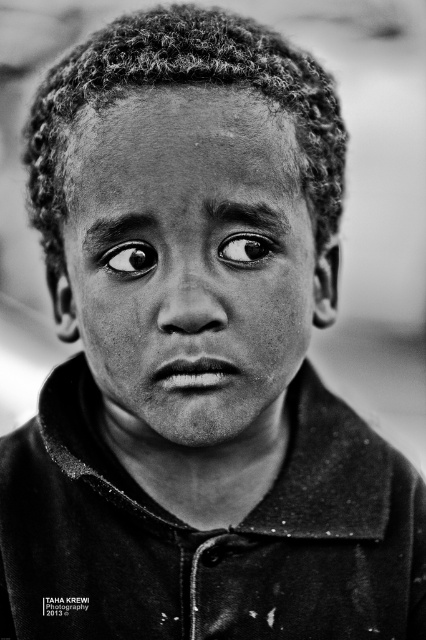
Can you confirm if smooth skin face at center is taller than black matte eye at center?

Indeed, smooth skin face at center has a greater height compared to black matte eye at center.

Is smooth skin face at center thinner than black matte eye at center?

No.

Who is more distant from viewer, (x=160, y=442) or (x=137, y=275)?

The point (x=160, y=442) is more distant.

Locate an element on the screen. Image resolution: width=426 pixels, height=640 pixels. smooth skin face at center is located at coordinates (189, 262).

Does black matte eye at upper center have a greater height compared to black matte eye at center?

No, black matte eye at upper center is not taller than black matte eye at center.

Which is in front, point (233, 250) or point (112, 259)?

Point (233, 250)

Where is `black matte eye at upper center`? black matte eye at upper center is located at coordinates (247, 248).

Does smooth skin face at center have a lesser width compared to black matte eye at upper center?

No.

Between smooth skin face at center and black matte eye at upper center, which one appears on the right side from the viewer's perspective?

black matte eye at upper center is more to the right.

Identify the location of smooth skin face at center. [189, 262].

You are a GUI agent. You are given a task and a screenshot of the screen. Output one action in this format:
    pyautogui.click(x=<x>, y=<y>)
    Task: Click on the smooth skin face at center
    Image resolution: width=426 pixels, height=640 pixels.
    Given the screenshot: What is the action you would take?
    pyautogui.click(x=189, y=262)